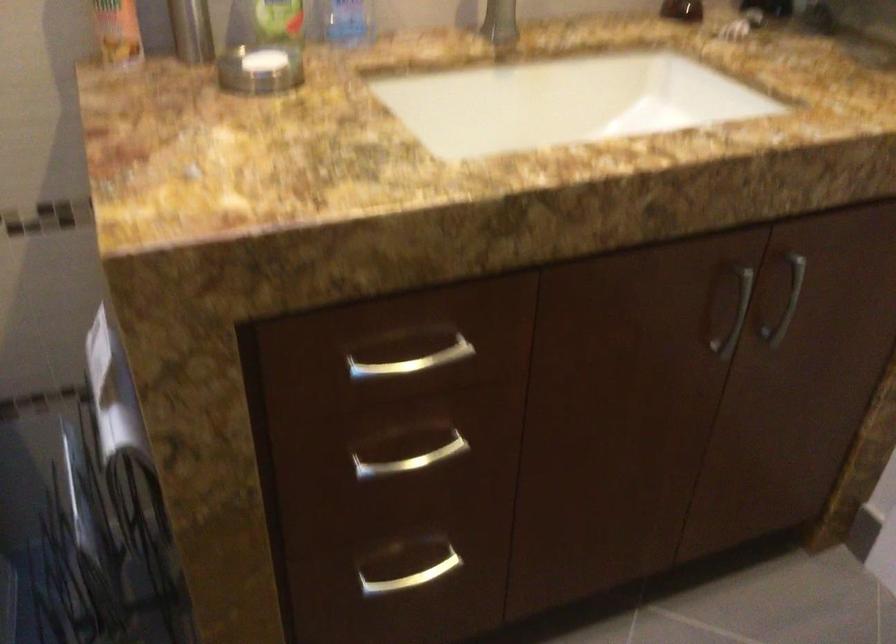
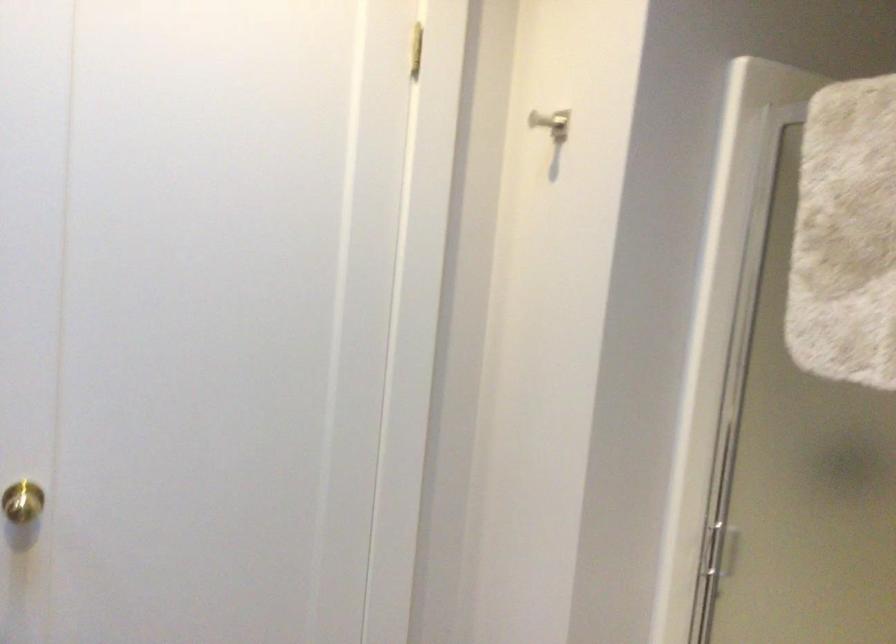
Question: How did the camera likely rotate?

Choices:
 (A) Left
 (B) Right
 (C) Up
 (D) Down

Answer: (B)